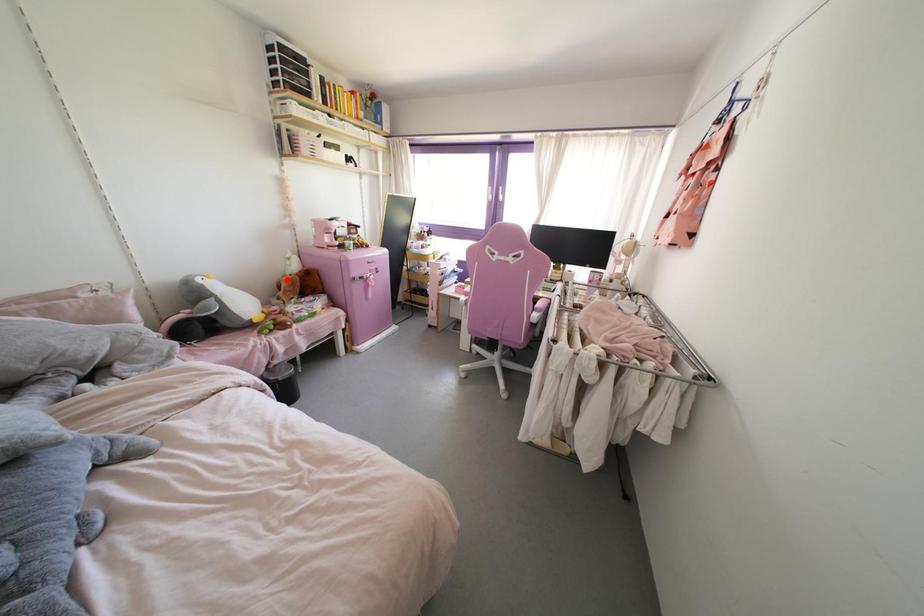
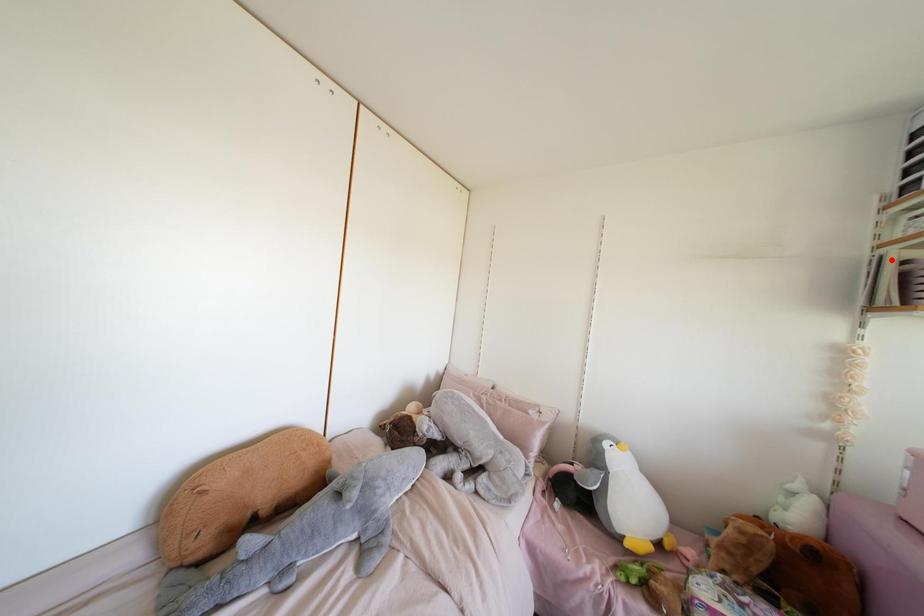
I am providing you with two images of the same scene from different viewpoints. A red point is marked on the first image and another point is marked on the second image. Do the highlighted points in image1 and image2 indicate the same real-world spot?

No